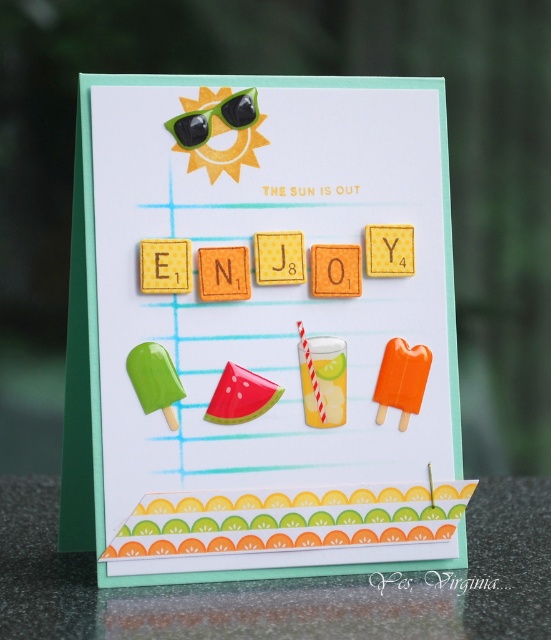
You are designing a greeting card and need to place a sticker of a sun above the green paper at lower center. According to the image, where should the sticker be placed relative to the green matte sunglasses at upper center?

The green paper at lower center is to the right of the green matte sunglasses at upper center. Therefore, the sticker should be placed above the green paper at lower center, which is to the right of the green matte sunglasses at upper center.

You are designing a new card and want to place a sticker exactly between the green paper at lower center and the green matte sunglasses at upper center. Which object will the sticker be closer to?

The sticker will be closer to the green matte sunglasses at upper center because the green paper at lower center is wider than the sunglasses, so the midpoint between them would be nearer to the narrower object.

You are designing a greeting card and want to add a new element between the green paper at lower center and the green matte sunglasses at upper center. Based on their positions, where should you place it to ensure it appears in the middle of them?

To place the new element between the green paper at lower center and the green matte sunglasses at upper center, position it halfway between them along the vertical axis since the green paper at lower center is closer to the viewer than the green matte sunglasses at upper center.